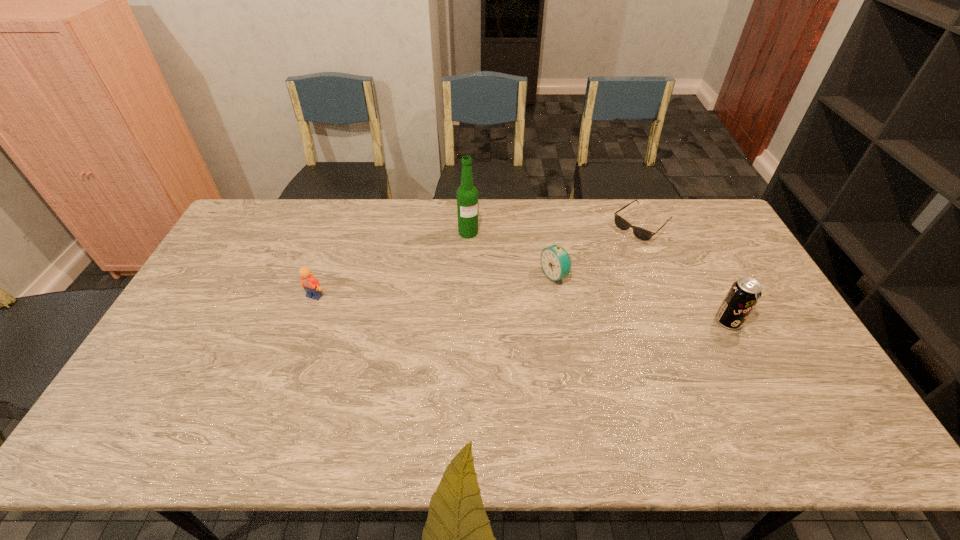
Locate an element on the screen. The height and width of the screenshot is (540, 960). vacant space located on the back of the nearest object is located at coordinates (694, 255).

Locate an element on the screen. The width and height of the screenshot is (960, 540). blank space located on the front-facing side of the alarm clock is located at coordinates (433, 330).

Find the location of a particular element. Image resolution: width=960 pixels, height=540 pixels. free space located on the front-facing side of the alarm clock is located at coordinates (426, 333).

This screenshot has height=540, width=960. Find the location of `free space located 0.350m on the front-facing side of the alarm clock`. free space located 0.350m on the front-facing side of the alarm clock is located at coordinates (443, 326).

Find the location of a particular element. This screenshot has height=540, width=960. vacant space located 0.180m on the label of the tallest object is located at coordinates (487, 273).

Find the location of a particular element. The width and height of the screenshot is (960, 540). vacant space located 0.250m on the label of the tallest object is located at coordinates (494, 288).

You are a GUI agent. You are given a task and a screenshot of the screen. Output one action in this format:
    pyautogui.click(x=<x>, y=<y>)
    Task: Click on the vacant area situated 0.240m on the label of the tallest object
    This screenshot has height=540, width=960.
    Given the screenshot: What is the action you would take?
    pos(493,286)

This screenshot has height=540, width=960. I want to click on free space located on the lenses of the sunglasses, so click(553, 297).

Find the location of a particular element. The height and width of the screenshot is (540, 960). vacant space located on the lenses of the sunglasses is located at coordinates (575, 279).

Find the location of `vacant area situated on the lenses of the sunglasses`. vacant area situated on the lenses of the sunglasses is located at coordinates (610, 251).